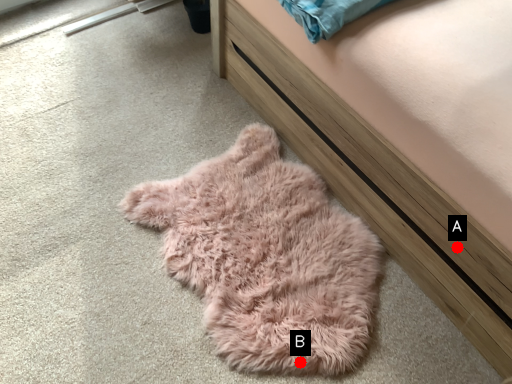
Question: Two points are circled on the image, labeled by A and B beside each circle. Which of the following is the farthest from the observer?

Choices:
 (A) A is further
 (B) B is further

Answer: (B)